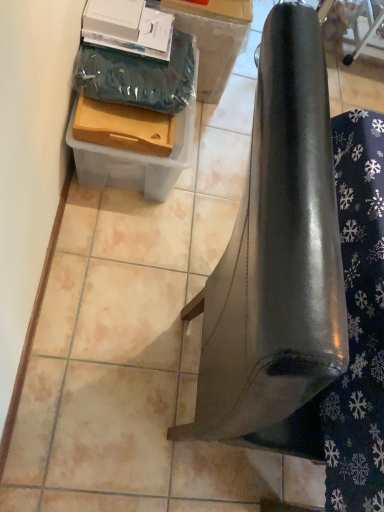
Image resolution: width=384 pixels, height=512 pixels. I want to click on free space in front of matte plastic box at upper left, the second cardboard box viewed from the top, so click(x=107, y=245).